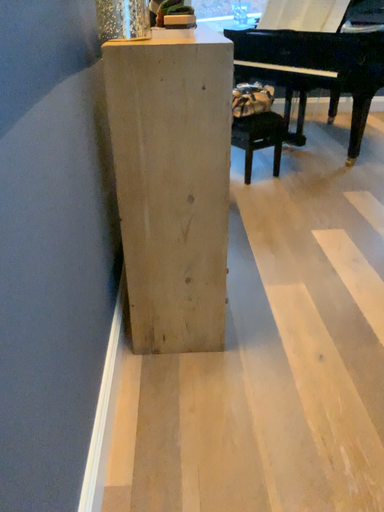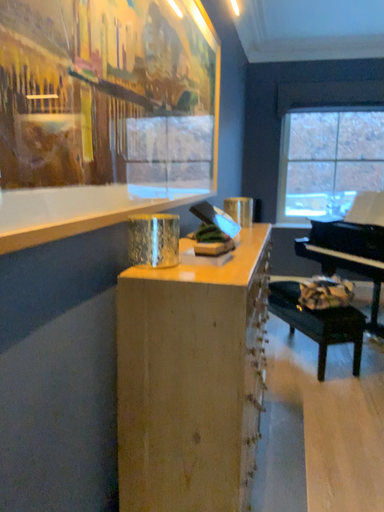
Question: Which way did the camera rotate in the video?

Choices:
 (A) rotated upward
 (B) rotated downward

Answer: (A)